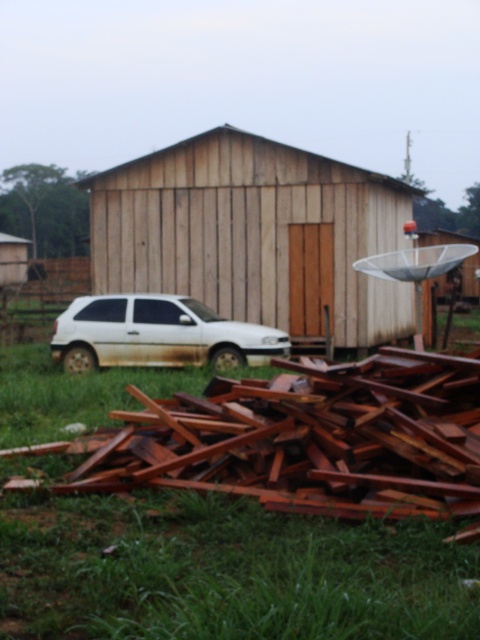
Question: Observing the image, what is the correct spatial positioning of green grass at lower center in reference to wooden satellite dish at right?

Choices:
 (A) above
 (B) below

Answer: (B)

Question: Can you confirm if green grass at lower center is wider than wooden planks at lower left?

Choices:
 (A) yes
 (B) no

Answer: (B)

Question: Which object appears farthest from the camera in this image?

Choices:
 (A) wooden at center
 (B) wooden satellite dish at right
 (C) white matte car at lower left
 (D) green grass at lower center

Answer: (A)

Question: Is white matte car at lower left positioned at the back of wooden satellite dish at right?

Choices:
 (A) no
 (B) yes

Answer: (B)

Question: Which of the following is the closest to the observer?

Choices:
 (A) (462, 268)
 (B) (23, 276)

Answer: (A)

Question: Which object appears farthest from the camera in this image?

Choices:
 (A) wooden planks at lower left
 (B) white matte car at lower left
 (C) wooden at center

Answer: (A)